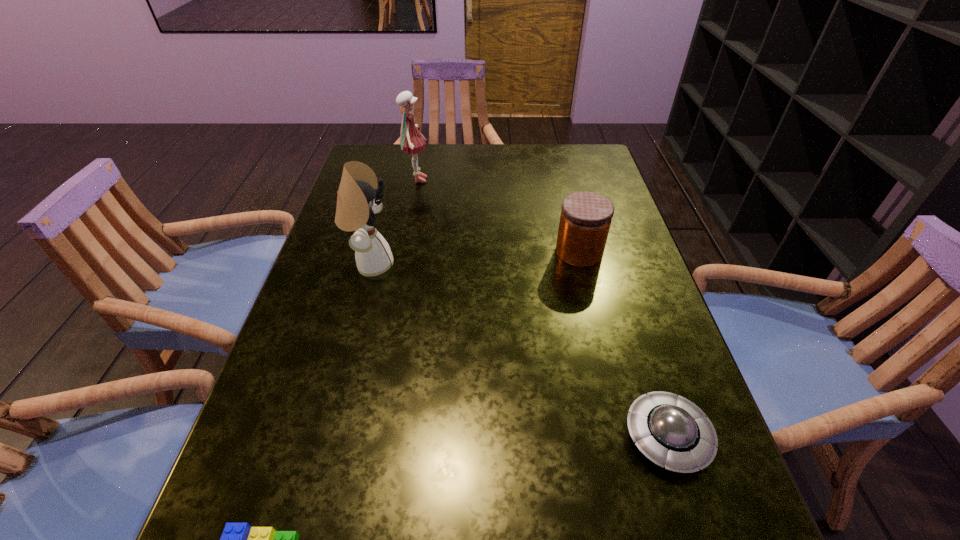
You are a GUI agent. You are given a task and a screenshot of the screen. Output one action in this format:
    pyautogui.click(x=<x>, y=<y>)
    Task: Click on the free space between the saucer and the farthest object
    
    Given the screenshot: What is the action you would take?
    pyautogui.click(x=542, y=308)

Identify the location of vacant region between the farthest object and the saucer. Image resolution: width=960 pixels, height=540 pixels. (542, 308).

At what (x,y) coordinates should I click in order to perform the action: click on the closest object relative to the third tallest object. Please return your answer as a coordinate pair (x, y). Looking at the image, I should click on (671, 431).

Locate which object is the second closest to the saucer. Please provide its 2D coordinates. Your answer should be formatted as a tuple, i.e. [(x, y)], where the tuple contains the x and y coordinates of a point satisfying the conditions above.

[(238, 539)]

Identify the location of vacant space that satisfies the following two spatial constraints: 1. on the front side of the third shortest object; 2. on the left side of the saucer. The width and height of the screenshot is (960, 540). (624, 436).

At what (x,y) coordinates should I click in order to perform the action: click on free location that satisfies the following two spatial constraints: 1. on the front-facing side of the farther doll; 2. on the left side of the saucer. Please return your answer as a coordinate pair (x, y). Looking at the image, I should click on (367, 436).

At what (x,y) coordinates should I click in order to perform the action: click on vacant position in the image that satisfies the following two spatial constraints: 1. on the front-facing side of the second nearest object; 2. on the right side of the farther doll. Please return your answer as a coordinate pair (x, y). Looking at the image, I should click on (367, 436).

Locate an element on the screen. This screenshot has height=540, width=960. free spot that satisfies the following two spatial constraints: 1. on the front-facing side of the farthest object; 2. on the right side of the jar is located at coordinates (402, 252).

Image resolution: width=960 pixels, height=540 pixels. In order to click on vacant area in the image that satisfies the following two spatial constraints: 1. on the front side of the second nearest object; 2. on the left side of the third shortest object in this screenshot , I will do `click(624, 436)`.

Locate an element on the screen. The height and width of the screenshot is (540, 960). blank space that satisfies the following two spatial constraints: 1. on the back side of the third shortest object; 2. on the front-facing side of the farthest object is located at coordinates (561, 180).